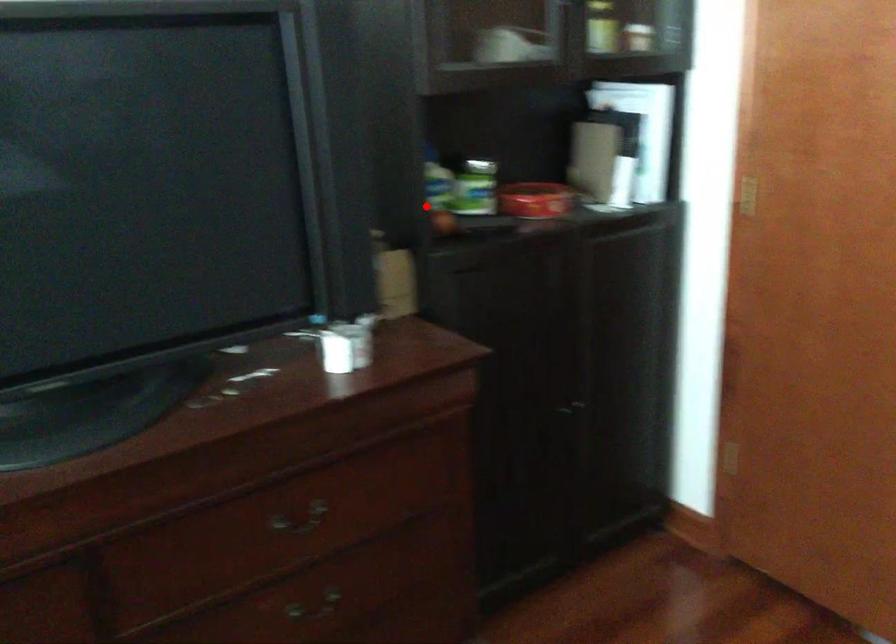
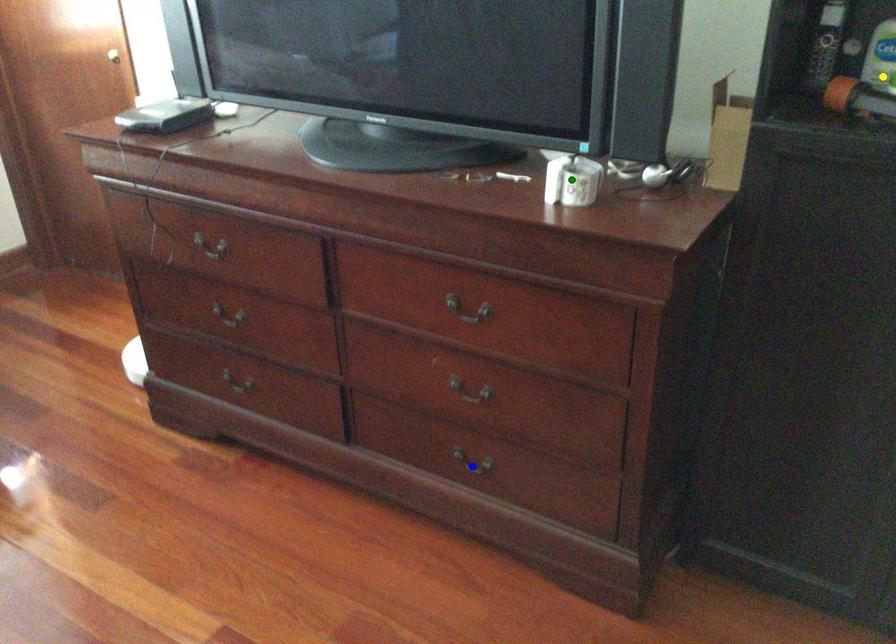
Question: I am providing you with two images of the same scene from different viewpoints. A red point is marked on the first image. You are given multiple points on the second image. In image 2, which mark is for the same physical point as the one in image 1?

Choices:
 (A) green point
 (B) blue point
 (C) yellow point

Answer: (C)